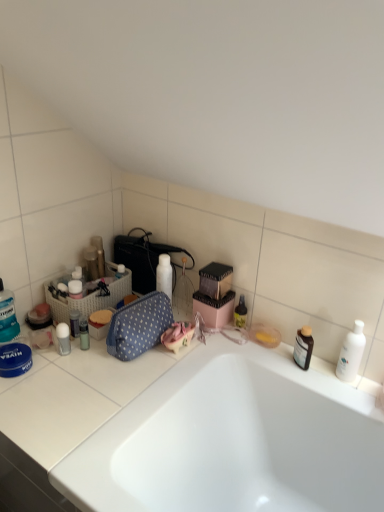
You are a GUI agent. You are given a task and a screenshot of the screen. Output one action in this format:
    pyautogui.click(x=<x>, y=<y>)
    Task: Click on the free space that is to the left of blue polka dot fabric bag at center
    The width and height of the screenshot is (384, 512).
    Given the screenshot: What is the action you would take?
    pyautogui.click(x=80, y=358)